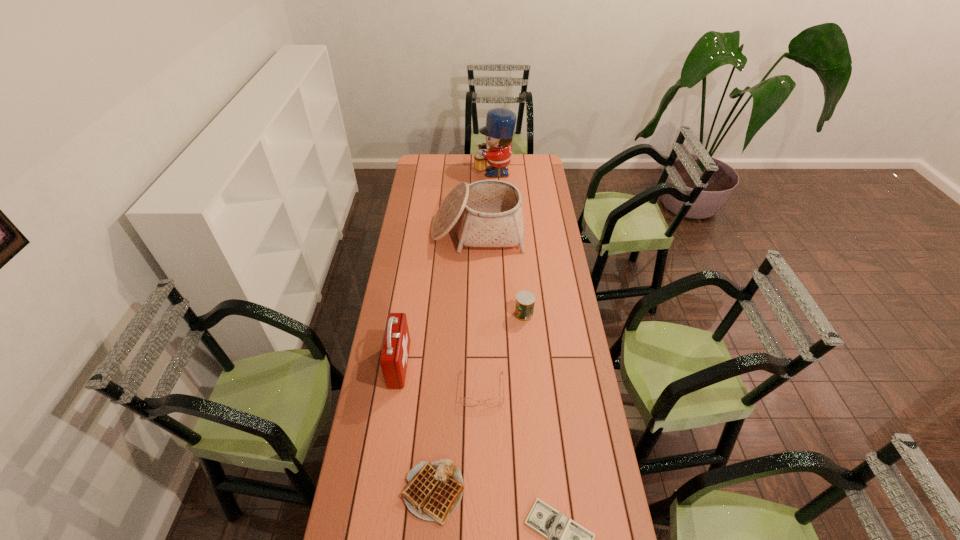
Image resolution: width=960 pixels, height=540 pixels. I want to click on vacant space at the left edge of the desktop, so click(x=384, y=313).

The height and width of the screenshot is (540, 960). Find the location of `vacant space at the right edge of the desktop`. vacant space at the right edge of the desktop is located at coordinates (552, 272).

Where is `blank space at the far left corner`? The image size is (960, 540). blank space at the far left corner is located at coordinates (418, 154).

Find the location of a particular element. The width and height of the screenshot is (960, 540). free space between the first-aid kit and the spectacles is located at coordinates (441, 377).

Find the location of a particular element. The height and width of the screenshot is (540, 960). vacant point located between the can and the first-aid kit is located at coordinates (462, 340).

Identify the location of vacant point located between the second farthest object and the spectacles. Image resolution: width=960 pixels, height=540 pixels. (480, 310).

Image resolution: width=960 pixels, height=540 pixels. I want to click on free space between the fourth shortest object and the first-aid kit, so click(462, 340).

At what (x,y) coordinates should I click in order to perform the action: click on free spot between the waffle and the basket. Please return your answer as a coordinate pair (x, y). Looking at the image, I should click on (456, 362).

I want to click on free space between the spectacles and the sixth nearest object, so click(x=480, y=310).

In order to click on vacant region between the leftmost object and the second farthest object in this screenshot , I will do (439, 298).